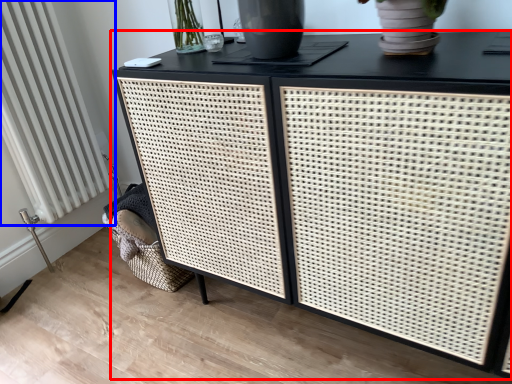
Question: Which point is further to the camera, table (highlighted by a red box) or radiator (highlighted by a blue box)?

Choices:
 (A) table
 (B) radiator

Answer: (B)